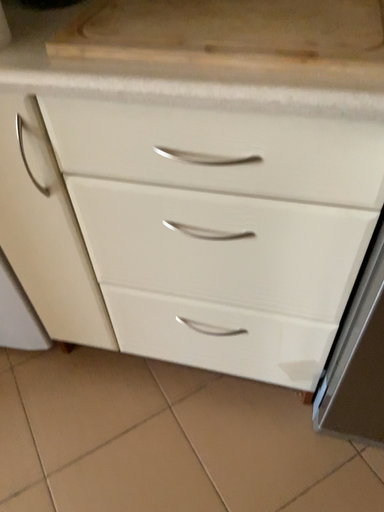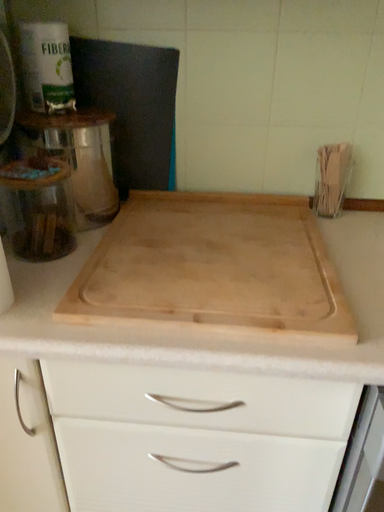
Question: How did the camera likely rotate when shooting the video?

Choices:
 (A) rotated left
 (B) rotated right

Answer: (B)